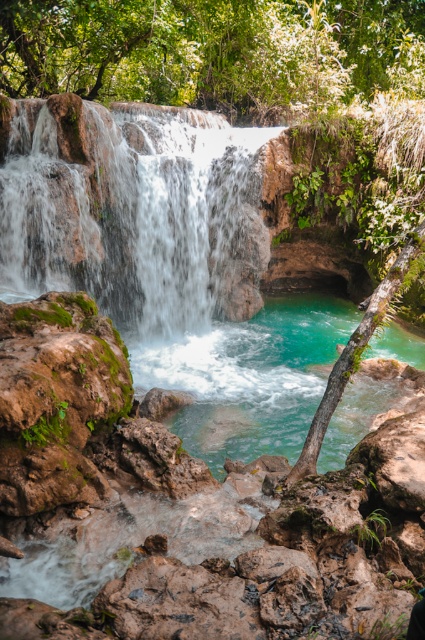
Is translucent white water at center shorter than turquoise glossy water at center?

Indeed, translucent white water at center has a lesser height compared to turquoise glossy water at center.

Is point (22, 216) closer to viewer compared to point (359, 426)?

No, it is not.

This screenshot has width=425, height=640. Find the location of `translucent white water at center`. translucent white water at center is located at coordinates (127, 211).